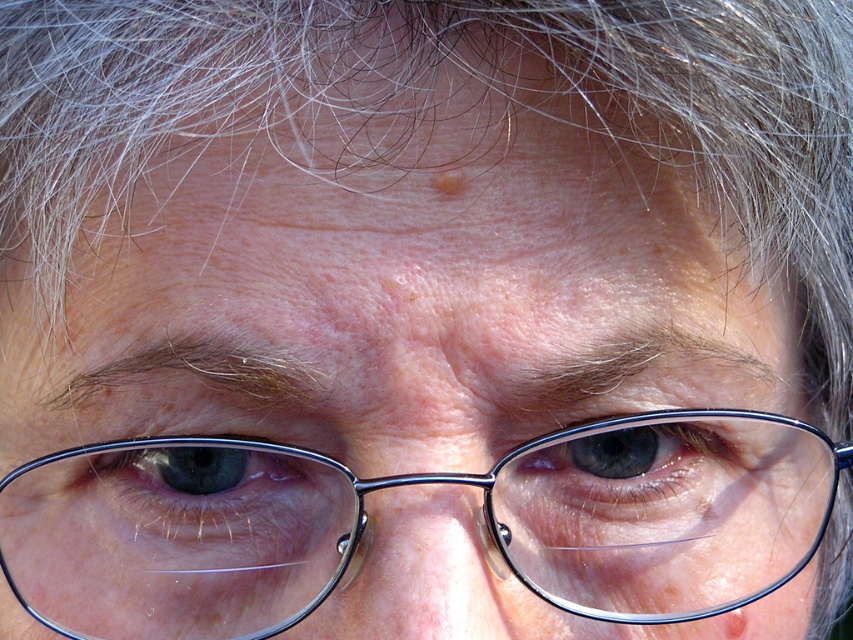
Who is positioned more to the left, metallic frame glasses at center or matte blue eye at center?

Positioned to the left is matte blue eye at center.

Is metallic frame glasses at center further to camera compared to matte blue eye at center?

No, it is in front of matte blue eye at center.

Does point (225, 470) come in front of point (347, 492)?

No, (225, 470) is behind (347, 492).

Locate an element on the screen. This screenshot has width=853, height=640. metallic frame glasses at center is located at coordinates (409, 484).

Who is positioned more to the left, metallic frame glasses at center or matte metal eye at center?

Positioned to the left is metallic frame glasses at center.

Based on the photo, which is below, metallic frame glasses at center or matte metal eye at center?

metallic frame glasses at center is below.

Does point (351, 516) lie in front of point (732, 435)?

That is True.

You are a GUI agent. You are given a task and a screenshot of the screen. Output one action in this format:
    pyautogui.click(x=<x>, y=<y>)
    Task: Click on the metallic frame glasses at center
    This screenshot has height=640, width=853.
    Given the screenshot: What is the action you would take?
    pyautogui.click(x=409, y=484)

Who is positioned more to the right, matte metal eye at center or matte blue eye at center?

matte metal eye at center

Locate an element on the screen. The height and width of the screenshot is (640, 853). matte metal eye at center is located at coordinates coord(635,474).

The image size is (853, 640). In order to click on matte metal eye at center in this screenshot , I will do `click(635, 474)`.